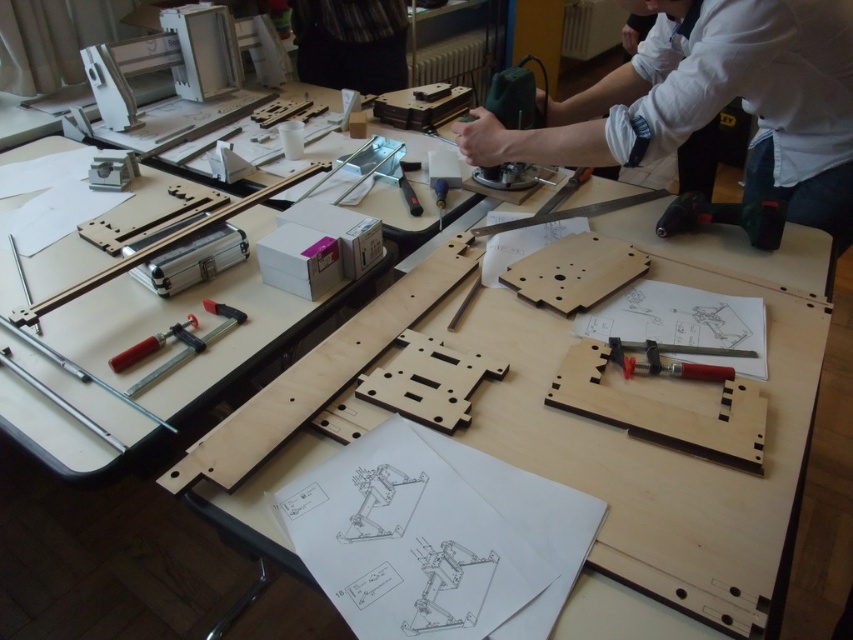
Question: Can you confirm if white shirt at upper right is wider than red plastic clamp at center?

Choices:
 (A) yes
 (B) no

Answer: (A)

Question: Which of the following is the closest to the observer?

Choices:
 (A) (363, 48)
 (B) (170, 333)
 (C) (683, 196)
 (D) (209, 310)

Answer: (B)

Question: Which point is closer to the camera taking this photo?

Choices:
 (A) (241, 310)
 (B) (676, 221)
 (C) (387, 68)

Answer: (A)

Question: Does red plastic clamp at center have a smaller size compared to matte black clamp at center?

Choices:
 (A) no
 (B) yes

Answer: (A)

Question: Which point is farther to the camera?

Choices:
 (A) red plastic clamp at center
 (B) white shirt at upper right
 (C) black fabric at upper center

Answer: (C)

Question: Is white shirt at upper right smaller than black fabric at upper center?

Choices:
 (A) no
 (B) yes

Answer: (A)